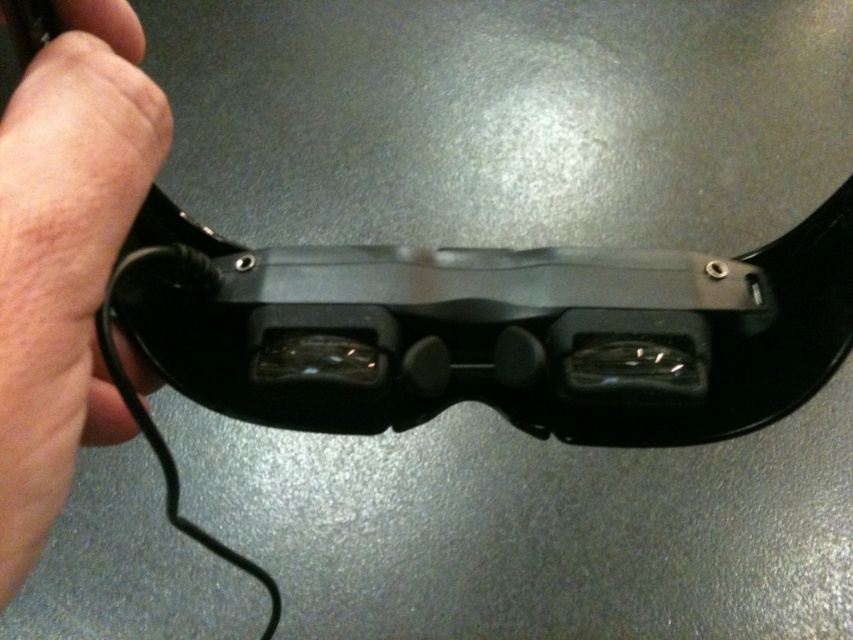
You are holding the pinky skin at lower left and want to place it next to the black plastic goggles at center. Based on their sizes, which object will occupy more horizontal space?

The black plastic goggles at center are wider than the pinky skin at lower left, so they will occupy more horizontal space.

You are a customer trying to put on the black plastic goggles at center. Based on the scene, do you need to move the pinky skin at lower left first?

The pinky skin at lower left is behind the black plastic goggles at center, so you do not need to move it before putting on the goggles.

You are a delivery person who needs to place a package containing the black plastic goggles at center and the pinky skin at lower left into a storage box. The box has a length of 5 inches. Can both items fit side by side in the box?

The black plastic goggles at center and pinky skin at lower left are 5.49 inches apart, so they cannot fit side by side in a 5 inch box since the distance between them exceeds the box length.